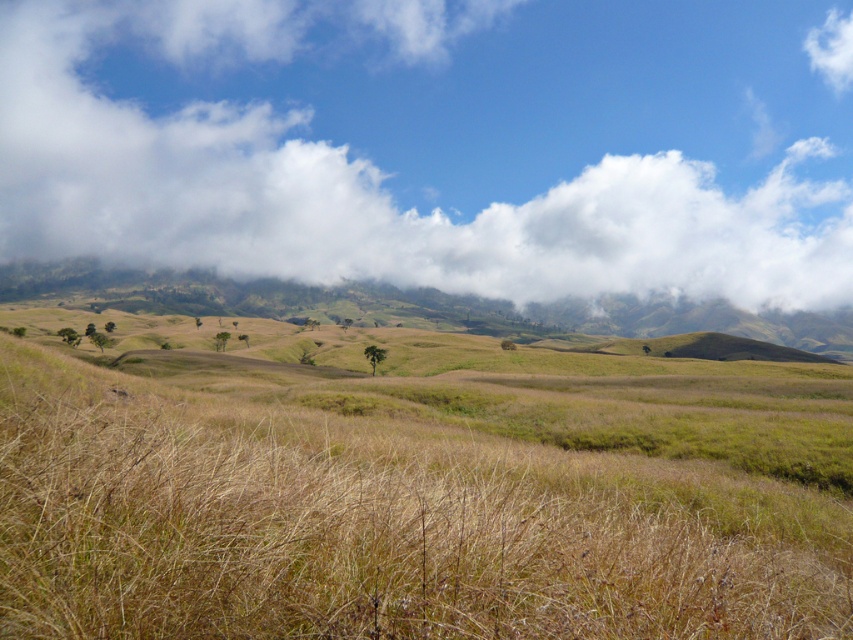
You are standing in the serene landscape described. There is a point marked at coordinates (440, 147). What object in the scene corresponds to this point?

The point at coordinates (440, 147) corresponds to the white fluffy cloud at upper center.

You are a photographer standing in the foreground of the scene. You want to capture a photo of the white fluffy cloud at upper center. Based on the coordinates provided, where should you position your camera to ensure the cloud is centered in your shot?

To center the white fluffy cloud at upper center in your photo, position your camera so that it is aimed at the coordinates point at 0.230 on the x axis and 0.517 on the y axis.

You are standing in the serene landscape described, and you want to take a photo of the white fluffy cloud at upper center. Considering the distance between you and the cloud, do you think you can capture the entire cloud in a single frame without zooming?

The distance between you and the white fluffy cloud at upper center is 2048.76 feet. Since clouds are typically large and distant, it might be challenging to capture the entire cloud in one frame without zooming, but this depends on your camera lens. However, given the vast distance, using a wide angle lens could help include the entire cloud in the photo.